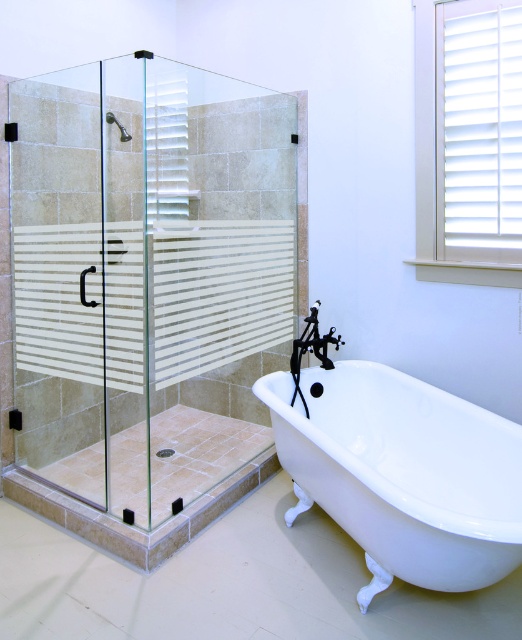
Can you confirm if clear glass shower door at left is positioned below matte silver handle at upper left?

Yes.

Does clear glass shower door at left have a lesser width compared to matte silver handle at upper left?

Incorrect, clear glass shower door at left's width is not less than matte silver handle at upper left's.

Identify the location of clear glass shower door at left. The image size is (522, 640). (149, 276).

Is white glossy bathtub at lower right bigger than matte silver handle at upper left?

Yes, white glossy bathtub at lower right is bigger than matte silver handle at upper left.

Consider the image. Does white glossy bathtub at lower right appear over matte silver handle at upper left?

Actually, white glossy bathtub at lower right is below matte silver handle at upper left.

Locate an element on the screen. The width and height of the screenshot is (522, 640). white glossy bathtub at lower right is located at coordinates (402, 474).

Can you confirm if clear glass shower door at left is taller than white glossy bathtub at lower right?

Yes, clear glass shower door at left is taller than white glossy bathtub at lower right.

What are the coordinates of `clear glass shower door at left` in the screenshot? It's located at (149, 276).